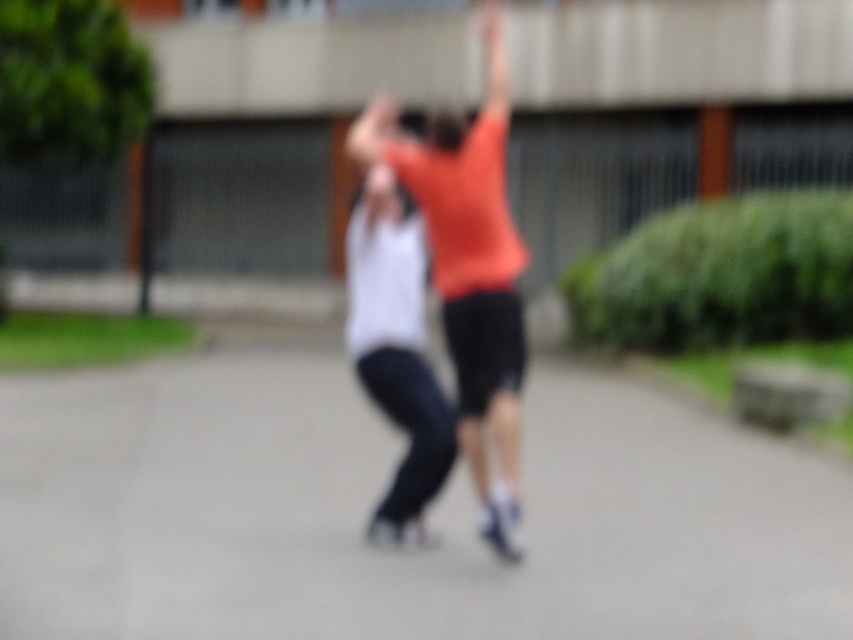
You are a photographer trying to capture a clear shot of the gray asphalt pavement at center and the white matte tank top at center in the blurry image. Based on their relative heights, which object should you focus on to ensure it appears sharp in the photo?

The gray asphalt pavement at center has a greater height compared to the white matte tank top at center, so focusing on the gray asphalt pavement at center would ensure it appears sharp since it is larger in the frame.

You are a photographer trying to capture a group photo of the orange cotton shirt at center and the white matte tank top at center. Since the image is blurry, you want to ensure both are fully visible. Which clothing item should you focus on first to ensure it fits within the frame?

The orange cotton shirt at center might be wider than the white matte tank top at center, so focusing on the orange cotton shirt at center first would ensure it fits within the frame.